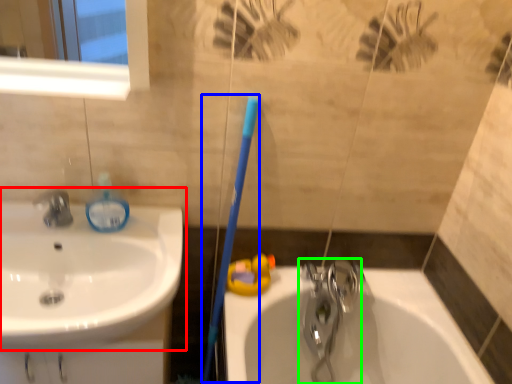
Question: Which is nearer to the sink (highlighted by a red box)? toothbrush (highlighted by a blue box) or tap (highlighted by a green box).

Choices:
 (A) toothbrush
 (B) tap

Answer: (A)